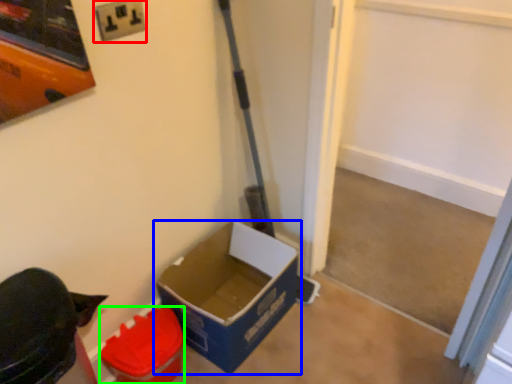
Question: Considering the real-world distances, which object is farthest from electric outlet (highlighted by a red box)? box (highlighted by a blue box) or box (highlighted by a green box)?

Choices:
 (A) box
 (B) box

Answer: (A)